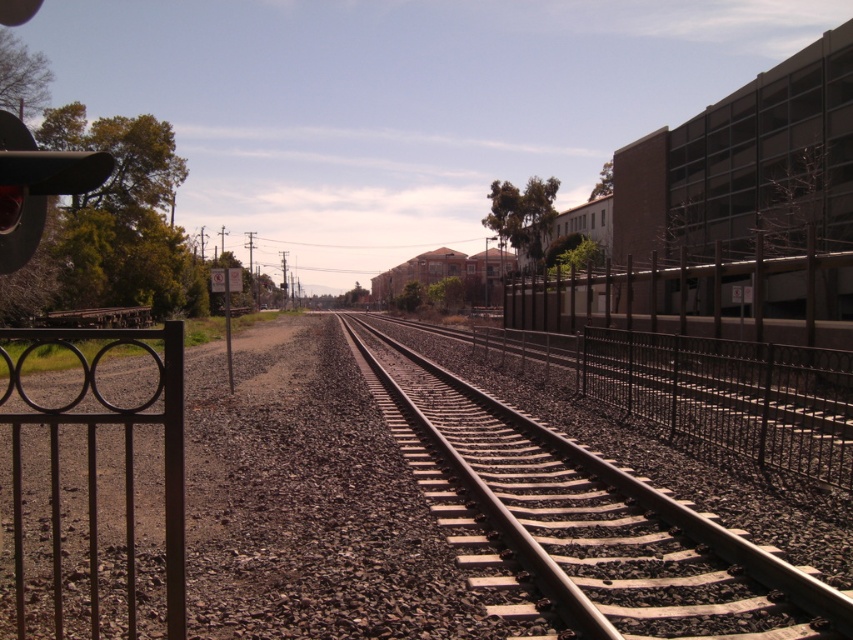
You are a railway inspector checking the track conditions. You notice the smooth metal track at center and the brown metal fence at right. Which object has a narrower width?

The smooth metal track at center is thinner than the brown metal fence at right, so the smooth metal track at center has a narrower width.

You are a pedestrian standing on the left side of the railway tracks. You want to cross to the right side where the building is. The brown wrought iron gate at left is locked. Can you go through the brown metal fence at right to reach the building?

The brown metal fence at right is to the right of the brown wrought iron gate at left, so it is on the same side as the building. However, fences typically do not allow passage, so you cannot go through the brown metal fence at right to reach the building.

You are a delivery person trying to reach the multi story building with large windows. You see the smooth metal track at center and the brown wrought iron gate at left. Which object is closer to the building?

The brown wrought iron gate at left is closer to the multi story building with large windows because the smooth metal track at center is located below it, placing the gate between the track and the building.